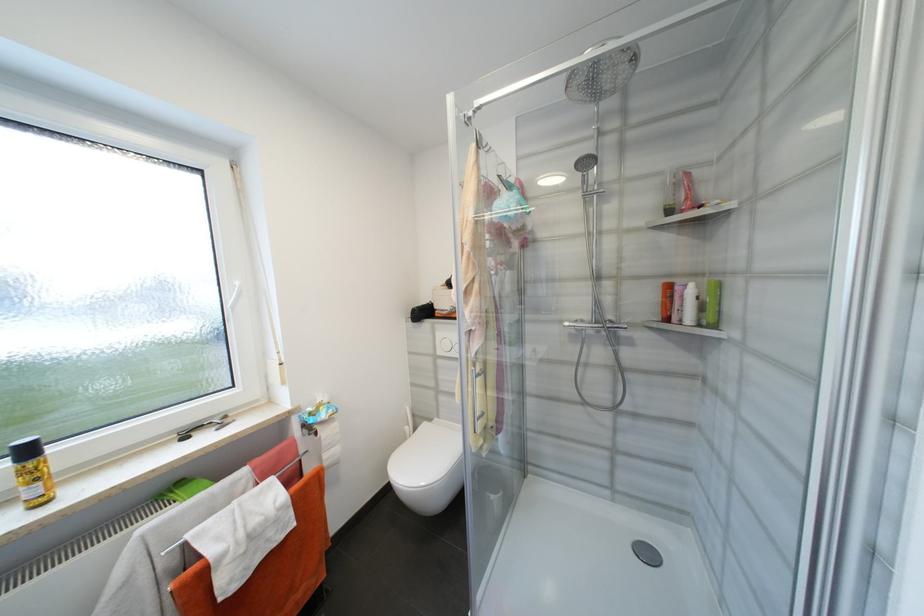
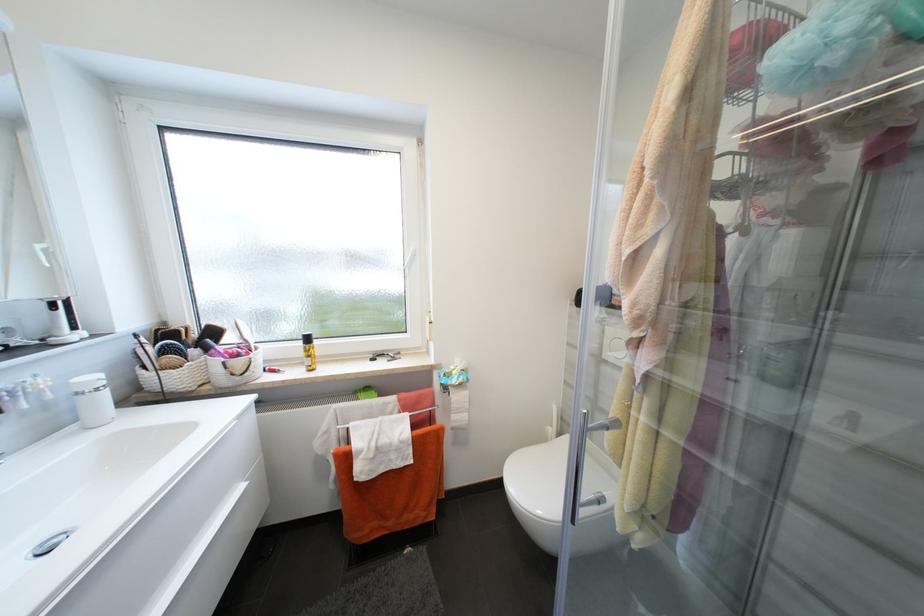
Question: How did the camera likely rotate?

Choices:
 (A) Left
 (B) Right
 (C) Up
 (D) Down

Answer: (A)